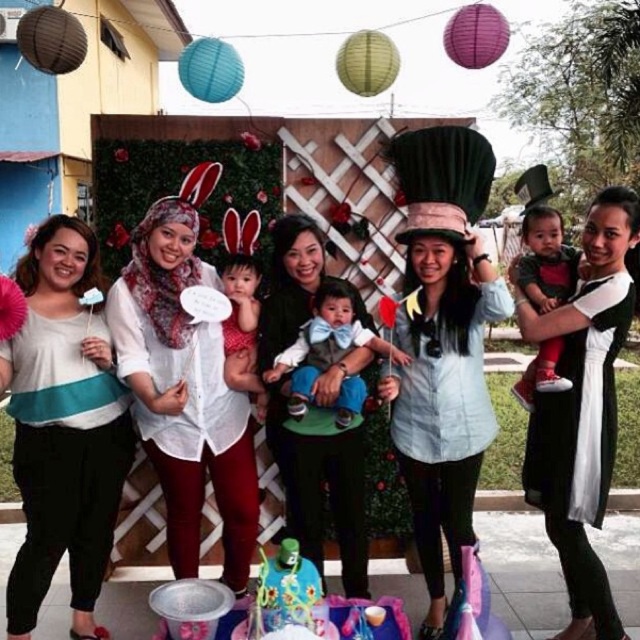
Does white matte shirt at left come in front of matte white dress at center?

Yes.

Between point (83, 627) and point (237, 376), which one is positioned behind?

The point (83, 627) is more distant.

You are a GUI agent. You are given a task and a screenshot of the screen. Output one action in this format:
    pyautogui.click(x=<x>, y=<y>)
    Task: Click on the white matte shirt at left
    This screenshot has width=640, height=640.
    Given the screenshot: What is the action you would take?
    pyautogui.click(x=64, y=428)

Between white matte scarf at center and white sheer dress at center, which one appears on the left side from the viewer's perspective?

white matte scarf at center is more to the left.

Does point (250, 525) come behind point (573, 307)?

Yes, it is behind point (573, 307).

Image resolution: width=640 pixels, height=640 pixels. I want to click on white matte scarf at center, so click(184, 392).

The image size is (640, 640). I want to click on white matte scarf at center, so click(184, 392).

Is point (605, 202) positioned in front of point (362, 394)?

Yes, it is.

The image size is (640, 640). Find the location of `white sheer dress at center`. white sheer dress at center is located at coordinates [x=582, y=406].